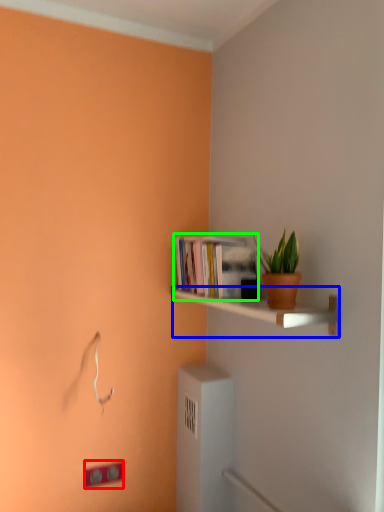
Question: Based on their relative distances, which object is nearer to light switch (highlighted by a red box)? Choose from shelf (highlighted by a blue box) and book (highlighted by a green box).

Choices:
 (A) shelf
 (B) book

Answer: (A)